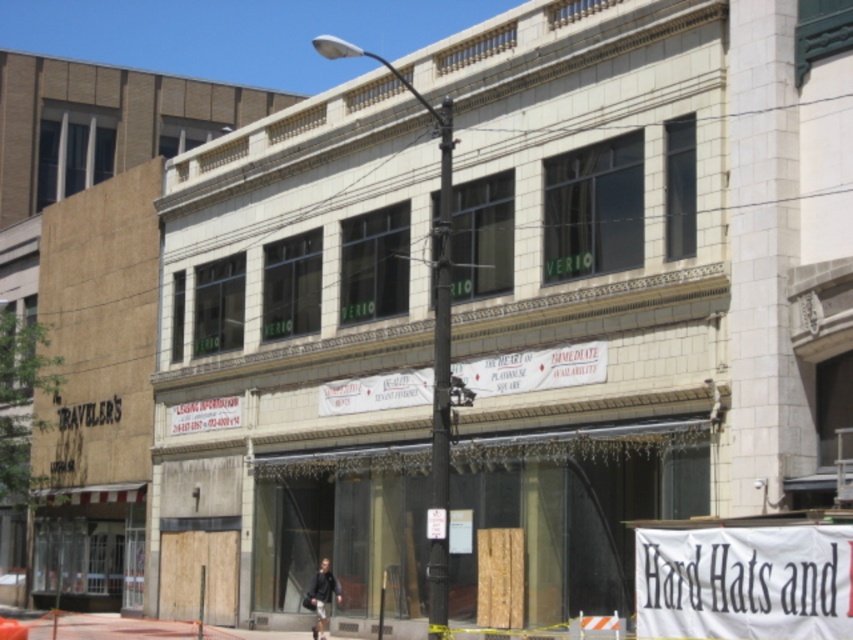
Question: Which point appears closest to the camera in this image?

Choices:
 (A) (796, 545)
 (B) (323, 620)

Answer: (A)

Question: Does white fabric banner at lower right appear under dark gray jacket at center?

Choices:
 (A) no
 (B) yes

Answer: (A)

Question: Is white fabric banner at lower right above dark gray jacket at center?

Choices:
 (A) no
 (B) yes

Answer: (B)

Question: Is white fabric banner at lower right thinner than dark gray jacket at center?

Choices:
 (A) yes
 (B) no

Answer: (B)

Question: Which point is farther from the camera taking this photo?

Choices:
 (A) (322, 595)
 (B) (697, 560)

Answer: (A)